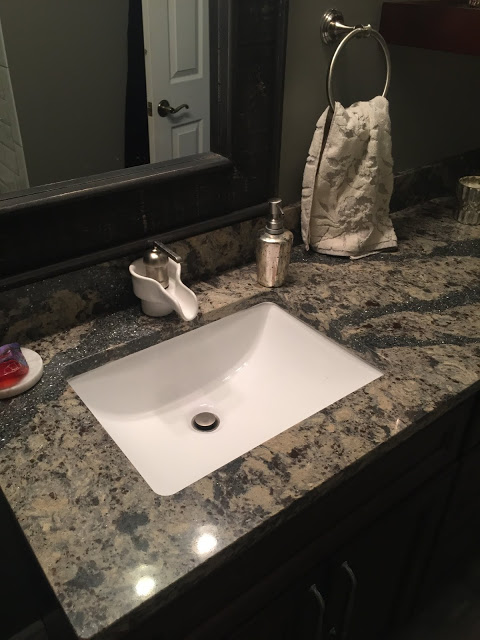
Find the location of a particular element. This screenshot has height=640, width=480. door is located at coordinates (162, 63).